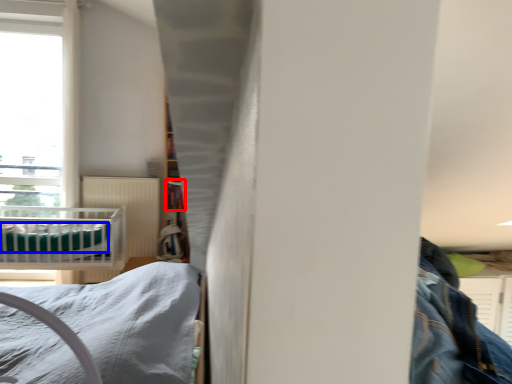
Question: Which point is closer to the camera, shelf (highlighted by a red box) or sheet (highlighted by a blue box)?

Choices:
 (A) shelf
 (B) sheet

Answer: (B)